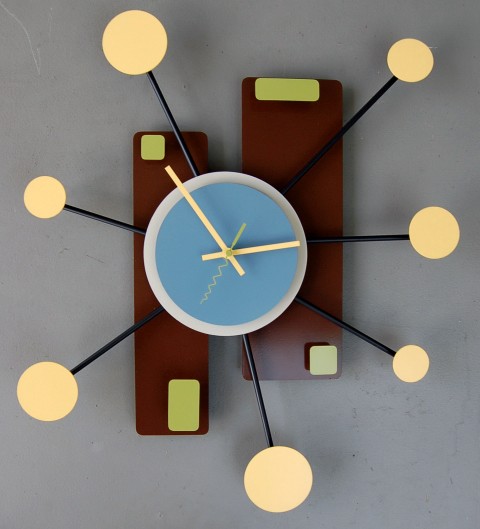
Where is `clock hand`? clock hand is located at coordinates (210, 227), (266, 247), (235, 240).